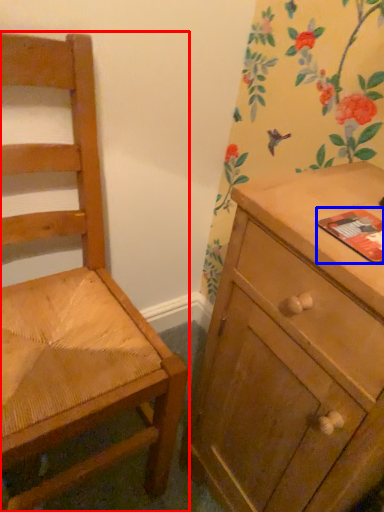
Question: Which object appears closest to the camera in this image, chair (highlighted by a red box) or paperback book (highlighted by a blue box)?

Choices:
 (A) chair
 (B) paperback book

Answer: (A)